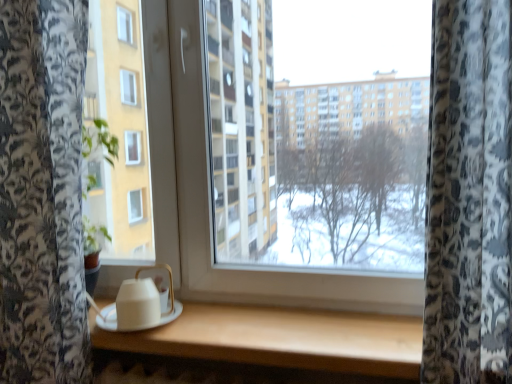
Describe the element at coordinates (138, 305) in the screenshot. I see `white matte teapot at lower left` at that location.

The width and height of the screenshot is (512, 384). What are the coordinates of `white matte teapot at lower left` in the screenshot? It's located at (138, 305).

The width and height of the screenshot is (512, 384). What do you see at coordinates (282, 339) in the screenshot?
I see `white matte table at center` at bounding box center [282, 339].

I want to click on white matte table at center, so click(x=282, y=339).

Find the location of `white matte teapot at lower left`. white matte teapot at lower left is located at coordinates (138, 305).

Can you confirm if white matte table at center is positioned to the left of white matte teapot at lower left?

Incorrect, white matte table at center is not on the left side of white matte teapot at lower left.

Is white matte table at center further to the viewer compared to white matte teapot at lower left?

No, white matte table at center is in front of white matte teapot at lower left.

Is point (388, 342) positioned before point (106, 310)?

Yes, it is in front of point (106, 310).

In the scene shown: From the image's perspective, between white matte table at center and white matte teapot at lower left, who is located below?

white matte table at center is shown below in the image.

From a real-world perspective, which is physically below, white matte table at center or white matte teapot at lower left?

white matte table at center.

Consider the image. Looking at their sizes, would you say white matte table at center is wider or thinner than white matte teapot at lower left?

In the image, white matte table at center appears to be wider than white matte teapot at lower left.

From their relative heights in the image, would you say white matte table at center is taller or shorter than white matte teapot at lower left?

white matte table at center is shorter than white matte teapot at lower left.

Can you confirm if white matte table at center is smaller than white matte teapot at lower left?

No.

Would you say white matte teapot at lower left is part of white matte table at center's contents?

No, white matte teapot at lower left is not surrounded by white matte table at center.

Is white matte table at center in contact with white matte teapot at lower left?

There is a gap between white matte table at center and white matte teapot at lower left.

Is white matte table at center positioned with its back to white matte teapot at lower left?

white matte table at center does not have its back to white matte teapot at lower left.

This screenshot has width=512, height=384. I want to click on tea set lying behind the white matte table at center, so click(x=138, y=305).

Which is more to the right, white matte teapot at lower left or white matte table at center?

white matte table at center is more to the right.

Does white matte teapot at lower left come behind white matte table at center?

Yes, white matte teapot at lower left is further from the viewer.

Is point (159, 319) farther from camera compared to point (231, 360)?

Yes, point (159, 319) is behind point (231, 360).

From the image's perspective, which is above, white matte teapot at lower left or white matte table at center?

white matte teapot at lower left appears higher in the image.

From a real-world perspective, is white matte teapot at lower left beneath white matte table at center?

Actually, white matte teapot at lower left is physically above white matte table at center in the real world.

Can you confirm if white matte teapot at lower left is wider than white matte table at center?

No.

Between white matte teapot at lower left and white matte table at center, which one has more height?

With more height is white matte teapot at lower left.

Which of these two, white matte teapot at lower left or white matte table at center, is bigger?

With larger size is white matte table at center.

Is white matte teapot at lower left positioned beyond the bounds of white matte table at center?

Yes, white matte teapot at lower left is located beyond the bounds of white matte table at center.

Is there a large distance between white matte teapot at lower left and white matte table at center?

Actually, white matte teapot at lower left and white matte table at center are a little close together.

Is white matte teapot at lower left facing away from white matte table at center?

No.

Measure the distance from white matte teapot at lower left to white matte table at center.

The distance of white matte teapot at lower left from white matte table at center is 8.96 inches.

Where is `table located in front of the white matte teapot at lower left`? This screenshot has width=512, height=384. table located in front of the white matte teapot at lower left is located at coordinates (x=282, y=339).

Where is `table in front of the white matte teapot at lower left`? The height and width of the screenshot is (384, 512). table in front of the white matte teapot at lower left is located at coordinates (282, 339).

Locate an element on the screen. The image size is (512, 384). tea set behind the white matte table at center is located at coordinates (138, 305).